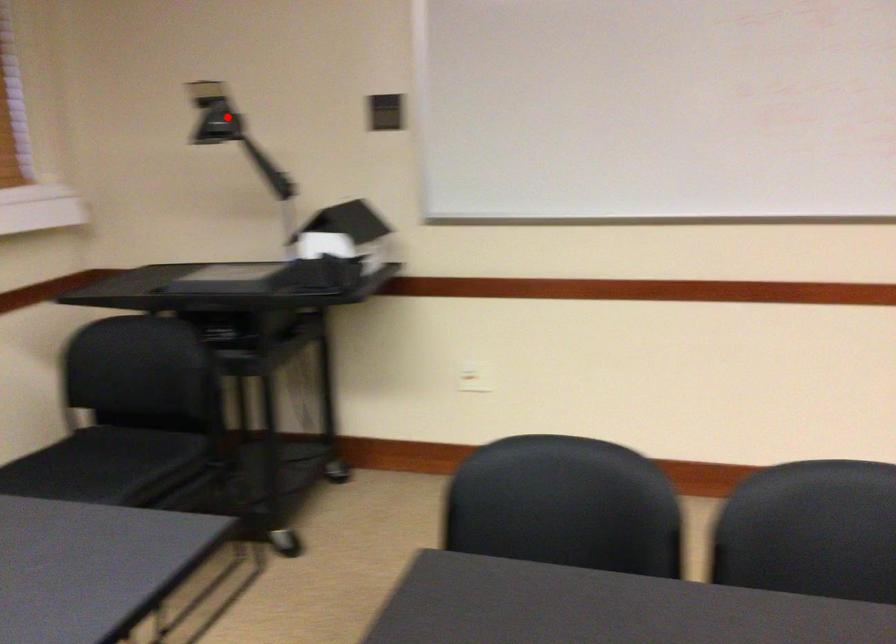
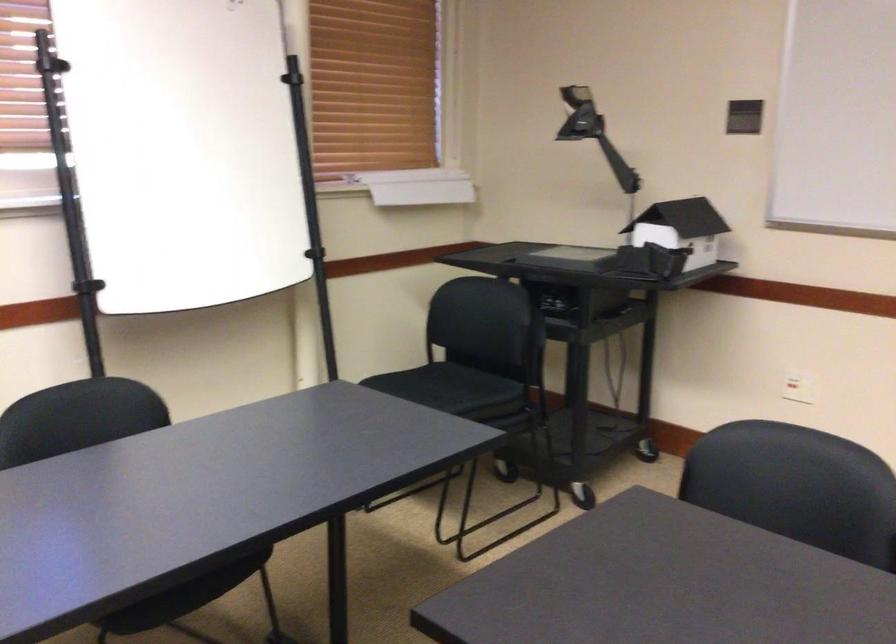
Locate, in the second image, the point that corresponds to the highlighted location in the first image.

(579, 115)